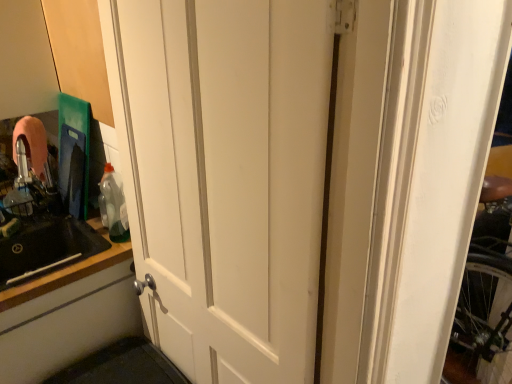
Question: Does white matte cabinet door at lower left have a lesser width compared to black matte countertop at left?

Choices:
 (A) no
 (B) yes

Answer: (B)

Question: Can you confirm if white matte cabinet door at lower left is taller than black matte countertop at left?

Choices:
 (A) no
 (B) yes

Answer: (A)

Question: Considering the relative sizes of white matte cabinet door at lower left and black matte countertop at left in the image provided, is white matte cabinet door at lower left shorter than black matte countertop at left?

Choices:
 (A) yes
 (B) no

Answer: (A)

Question: Does white matte cabinet door at lower left appear on the left side of black matte countertop at left?

Choices:
 (A) yes
 (B) no

Answer: (B)

Question: From a real-world perspective, is white matte cabinet door at lower left physically above black matte countertop at left?

Choices:
 (A) no
 (B) yes

Answer: (A)

Question: Relative to translucent plastic bottle at left, is black matte countertop at left in front or behind?

Choices:
 (A) front
 (B) behind

Answer: (A)

Question: In terms of size, does black matte countertop at left appear bigger or smaller than translucent plastic bottle at left?

Choices:
 (A) small
 (B) big

Answer: (B)

Question: Considering the positions of point (96, 228) and point (116, 208), is point (96, 228) closer or farther from the camera than point (116, 208)?

Choices:
 (A) closer
 (B) farther

Answer: (B)

Question: Visually, is black matte countertop at left positioned to the left or to the right of translucent plastic bottle at left?

Choices:
 (A) left
 (B) right

Answer: (A)

Question: In the image, is translucent plastic bottle at left on the left side or the right side of black matte countertop at left?

Choices:
 (A) left
 (B) right

Answer: (B)

Question: In terms of width, does translucent plastic bottle at left look wider or thinner when compared to black matte countertop at left?

Choices:
 (A) thin
 (B) wide

Answer: (A)

Question: Considering the positions of point (102, 196) and point (27, 291), is point (102, 196) closer or farther from the camera than point (27, 291)?

Choices:
 (A) closer
 (B) farther

Answer: (B)

Question: From a real-world perspective, is translucent plastic bottle at left positioned above or below black matte countertop at left?

Choices:
 (A) above
 (B) below

Answer: (A)

Question: Considering the positions of black matte sink at left and black matte countertop at left in the image, is black matte sink at left taller or shorter than black matte countertop at left?

Choices:
 (A) tall
 (B) short

Answer: (A)

Question: Is black matte sink at left in front of or behind black matte countertop at left in the image?

Choices:
 (A) front
 (B) behind

Answer: (A)